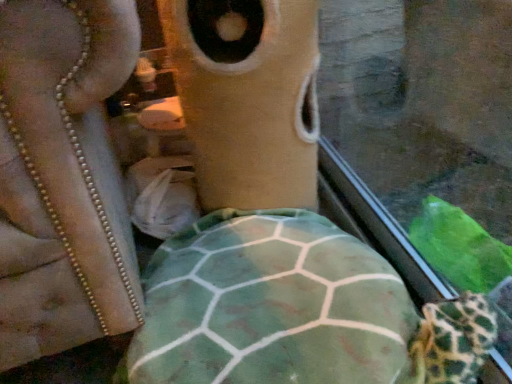
Find the location of a particular element. The width and height of the screenshot is (512, 384). green fabric tortoise at center is located at coordinates (294, 310).

The height and width of the screenshot is (384, 512). Describe the element at coordinates (294, 310) in the screenshot. I see `green fabric tortoise at center` at that location.

Describe the element at coordinates (248, 98) in the screenshot. Image resolution: width=512 pixels, height=384 pixels. I see `fuzzy beige cat at center` at that location.

In order to click on fuzzy beige cat at center in this screenshot , I will do (248, 98).

Locate an element on the screen. The width and height of the screenshot is (512, 384). green fabric tortoise at center is located at coordinates (294, 310).

Is fuzzy beige cat at center at the right side of green fabric tortoise at center?

Yes, fuzzy beige cat at center is to the right of green fabric tortoise at center.

Is fuzzy beige cat at center positioned behind green fabric tortoise at center?

Yes, the depth of fuzzy beige cat at center is greater than that of green fabric tortoise at center.

Does point (225, 183) appear closer or farther from the camera than point (170, 359)?

Point (225, 183) is farther from the camera than point (170, 359).

From the image's perspective, between fuzzy beige cat at center and green fabric tortoise at center, who is located below?

green fabric tortoise at center, from the image's perspective.

From the picture: From a real-world perspective, is fuzzy beige cat at center physically located above or below green fabric tortoise at center?

Clearly, from a real-world perspective, fuzzy beige cat at center is above green fabric tortoise at center.

Can you confirm if fuzzy beige cat at center is wider than green fabric tortoise at center?

In fact, fuzzy beige cat at center might be narrower than green fabric tortoise at center.

Which of these two, fuzzy beige cat at center or green fabric tortoise at center, stands shorter?

Standing shorter between the two is green fabric tortoise at center.

Between fuzzy beige cat at center and green fabric tortoise at center, which one has smaller size?

With smaller size is fuzzy beige cat at center.

Is fuzzy beige cat at center not inside green fabric tortoise at center?

fuzzy beige cat at center lies outside green fabric tortoise at center's area.

In the scene shown: Are fuzzy beige cat at center and green fabric tortoise at center making contact?

No, fuzzy beige cat at center is not with green fabric tortoise at center.

Is fuzzy beige cat at center turned away from green fabric tortoise at center?

That's not correct — fuzzy beige cat at center is not looking away from green fabric tortoise at center.

Can you tell me how much fuzzy beige cat at center and green fabric tortoise at center differ in facing direction?

The facing directions of fuzzy beige cat at center and green fabric tortoise at center are 0.00112 degrees apart.

How much distance is there between fuzzy beige cat at center and green fabric tortoise at center?

They are 13.10 inches apart.

Where is `tortoise that appears in front of the fuzzy beige cat at center`? tortoise that appears in front of the fuzzy beige cat at center is located at coordinates (294, 310).

Is green fabric tortoise at center to the left or to the right of fuzzy beige cat at center in the image?

Clearly, green fabric tortoise at center is on the left of fuzzy beige cat at center in the image.

Is green fabric tortoise at center positioned behind fuzzy beige cat at center?

No, green fabric tortoise at center is closer to the viewer.

Is point (346, 266) positioned in front of point (204, 194)?

Yes, it is.

From the image's perspective, which one is positioned lower, green fabric tortoise at center or fuzzy beige cat at center?

green fabric tortoise at center.

From a real-world perspective, which object rests below the other?

In real-world perspective, green fabric tortoise at center is lower.

Considering the relative sizes of green fabric tortoise at center and fuzzy beige cat at center in the image provided, is green fabric tortoise at center thinner than fuzzy beige cat at center?

Incorrect, the width of green fabric tortoise at center is not less than that of fuzzy beige cat at center.

Who is taller, green fabric tortoise at center or fuzzy beige cat at center?

Standing taller between the two is fuzzy beige cat at center.

Between green fabric tortoise at center and fuzzy beige cat at center, which one has larger size?

Bigger between the two is green fabric tortoise at center.

Is green fabric tortoise at center completely or partially outside of fuzzy beige cat at center?

green fabric tortoise at center lies outside fuzzy beige cat at center's area.

Are green fabric tortoise at center and fuzzy beige cat at center located far from each other?

green fabric tortoise at center is actually quite close to fuzzy beige cat at center.

Could you tell me if green fabric tortoise at center is turned towards fuzzy beige cat at center?

No, green fabric tortoise at center does not turn towards fuzzy beige cat at center.

What's the angular difference between green fabric tortoise at center and fuzzy beige cat at center's facing directions?

green fabric tortoise at center and fuzzy beige cat at center are facing 0.00112 degrees away from each other.

What are the coordinates of `tortoise below the fuzzy beige cat at center (from the image's perspective)` in the screenshot? It's located at (294, 310).

You are a GUI agent. You are given a task and a screenshot of the screen. Output one action in this format:
    pyautogui.click(x=<x>, y=<y>)
    Task: Click on the tortoise that appears below the fuzzy beige cat at center (from the image's perspective)
    The height and width of the screenshot is (384, 512).
    Given the screenshot: What is the action you would take?
    pyautogui.click(x=294, y=310)

I want to click on face behind the green fabric tortoise at center, so click(x=248, y=98).